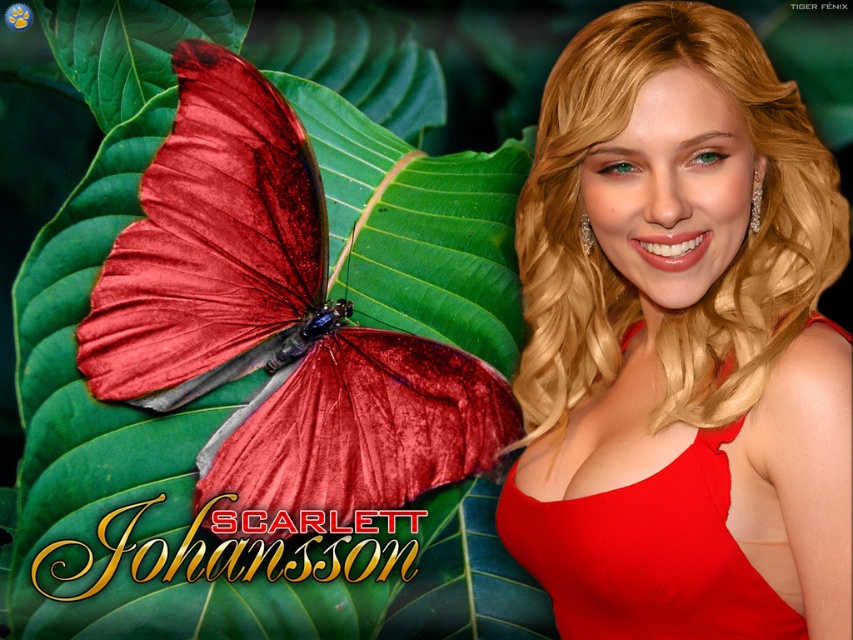
Between point (125, 234) and point (676, 550), which one is positioned behind?

Point (125, 234)

Which is below, velvet-like red butterfly at left or matte red dress at right?

Positioned lower is matte red dress at right.

Is point (212, 264) positioned before point (718, 561)?

No, it is not.

Locate an element on the screen. velvet-like red butterfly at left is located at coordinates (273, 326).